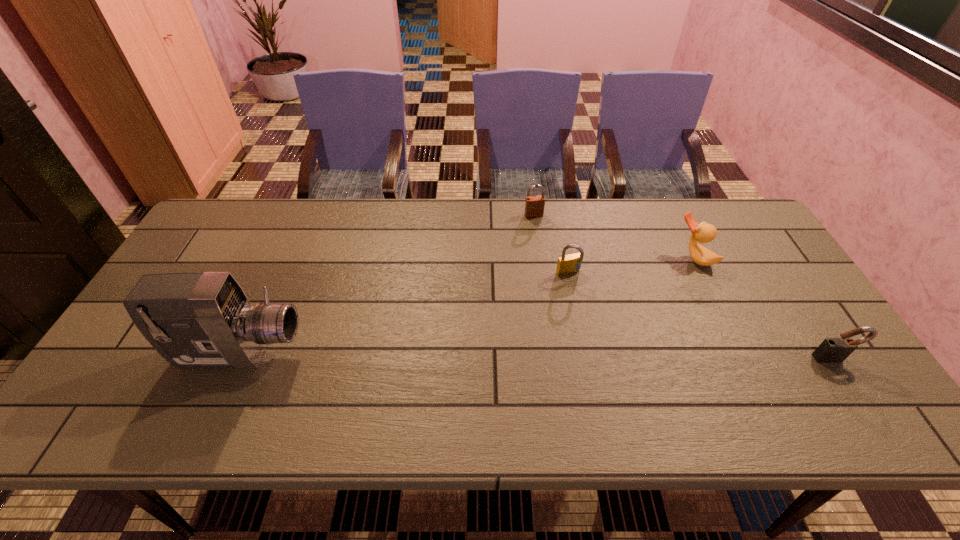
The width and height of the screenshot is (960, 540). What are the coordinates of `vacant space located 0.050m with the keyhole on the front of the rightmost object` in the screenshot? It's located at (849, 381).

Identify the location of vacant region located on the front-facing side of the leftmost padlock. (561, 276).

What are the coordinates of `free region located 0.220m on the front-facing side of the leftmost padlock` in the screenshot? It's located at (555, 265).

The height and width of the screenshot is (540, 960). What are the coordinates of `vacant region located 0.350m on the front-facing side of the leftmost padlock` in the screenshot? It's located at (569, 297).

This screenshot has height=540, width=960. Identify the location of vacant space situated on the beak of the duck. (623, 317).

In order to click on vacant space situated 0.390m on the beak of the duck in this screenshot , I will do `click(599, 337)`.

Where is `vacant space located 0.210m on the beak of the duck`? vacant space located 0.210m on the beak of the duck is located at coordinates (641, 302).

Locate an element on the screen. free space located 0.320m on the side with the combination dials of the second padlock from right to left is located at coordinates (634, 371).

The width and height of the screenshot is (960, 540). Identify the location of vacant space located 0.160m on the side with the combination dials of the second padlock from right to left. (600, 321).

Locate an element on the screen. The image size is (960, 540). free space located on the side with the combination dials of the second padlock from right to left is located at coordinates (640, 381).